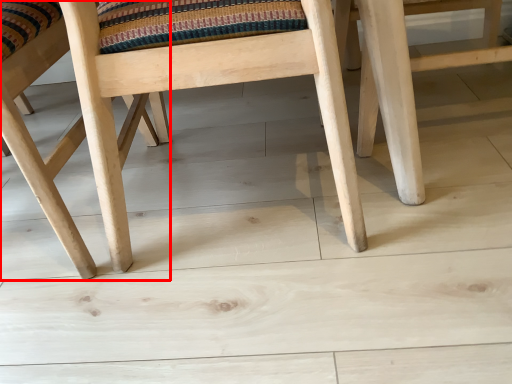
Question: From the image's perspective, where is chair (annotated by the red box) located relative to chair?

Choices:
 (A) below
 (B) above

Answer: (A)